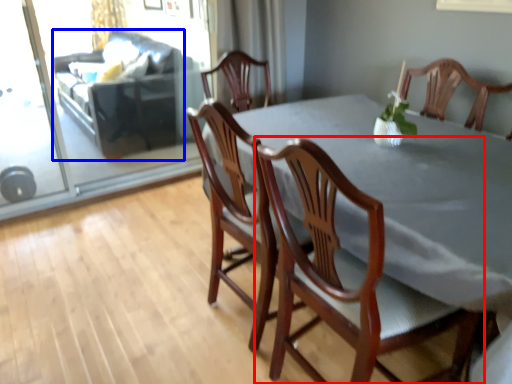
Question: Which object is further to the camera taking this photo, chair (highlighted by a red box) or couch (highlighted by a blue box)?

Choices:
 (A) chair
 (B) couch

Answer: (B)